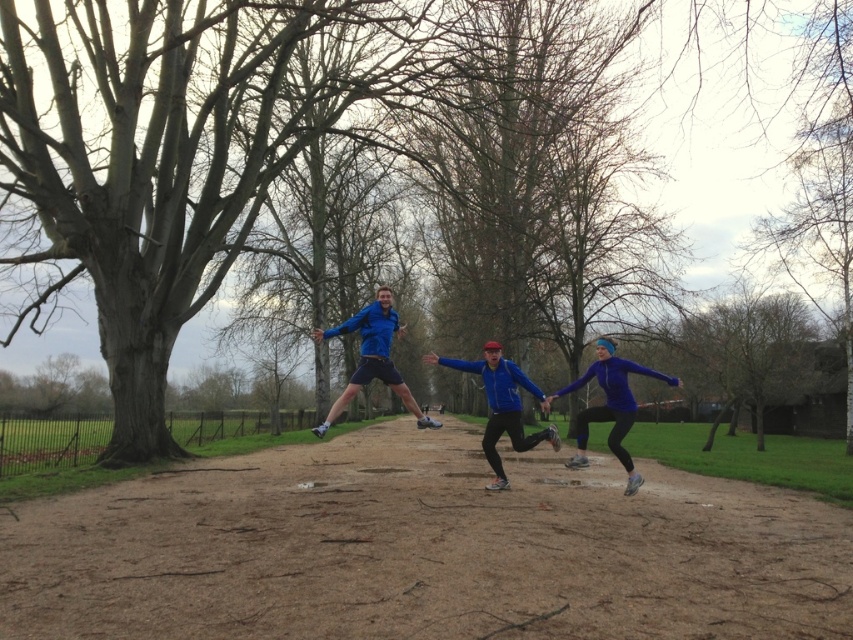
From the picture: You are a photographer trying to capture a photo of the blue fabric jacket at center and the matte blue jacket at lower right. Which jacket should you focus on first to ensure it appears sharp in the foreground?

The blue fabric jacket at center should be focused on first because it is in front of the matte blue jacket at lower right, making it the foreground element.

You are a photographer standing at the edge of the dirt path. You want to take a photo of both the blue fabric jacket at center and the matte blue jacket at lower right in the same frame. Given their current positions, can you capture both in a single shot without moving your camera?

The blue fabric jacket at center and the matte blue jacket at lower right are 3.59 feet apart. Since they are within a close distance, it is possible to capture both in a single shot without moving the camera.

Based on the coordinates provided, which object is located at point (x=193, y=147)?

The brown bark tree at center is located at point (x=193, y=147).